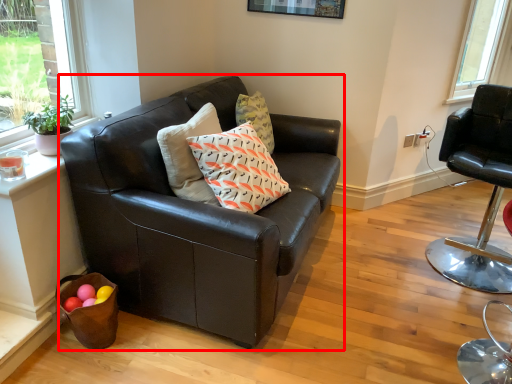
Question: Considering the relative positions of studio couch (annotated by the red box) and chair in the image provided, where is studio couch (annotated by the red box) located with respect to the staircase?

Choices:
 (A) right
 (B) left

Answer: (B)